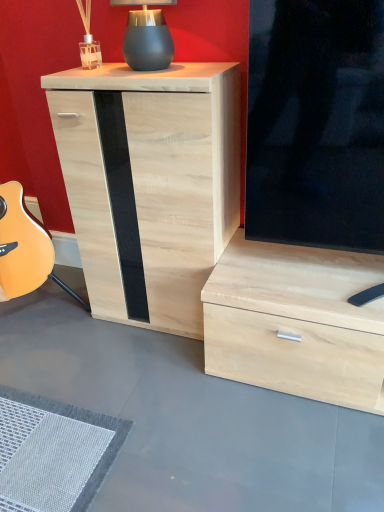
At what (x,y) coordinates should I click in order to perform the action: click on matte black lamp at upper center. Please return your answer as a coordinate pair (x, y). This screenshot has height=512, width=384. Looking at the image, I should click on (147, 36).

The image size is (384, 512). What do you see at coordinates (147, 36) in the screenshot?
I see `matte black lamp at upper center` at bounding box center [147, 36].

The image size is (384, 512). What do you see at coordinates (149, 183) in the screenshot? I see `natural wood cabinet at center` at bounding box center [149, 183].

This screenshot has width=384, height=512. I want to click on natural wood cabinet at center, so click(149, 183).

Find the location of a particular element. This screenshot has width=384, height=512. matte black lamp at upper center is located at coordinates (147, 36).

Considering the positions of objects natural wood cabinet at center and matte black lamp at upper center in the image provided, who is more to the left, natural wood cabinet at center or matte black lamp at upper center?

Positioned to the left is matte black lamp at upper center.

Which object is further away from the camera, natural wood cabinet at center or matte black lamp at upper center?

Positioned behind is matte black lamp at upper center.

Is point (206, 254) farther from viewer compared to point (149, 16)?

That is True.

From the image's perspective, between natural wood cabinet at center and matte black lamp at upper center, who is located below?

natural wood cabinet at center.

From a real-world perspective, is natural wood cabinet at center located beneath matte black lamp at upper center?

Yes, from a real-world perspective, natural wood cabinet at center is beneath matte black lamp at upper center.

Which object is thinner, natural wood cabinet at center or matte black lamp at upper center?

With smaller width is matte black lamp at upper center.

Between natural wood cabinet at center and matte black lamp at upper center, which one has more height?

natural wood cabinet at center.

Is natural wood cabinet at center bigger than matte black lamp at upper center?

Indeed, natural wood cabinet at center has a larger size compared to matte black lamp at upper center.

Consider the image. Is natural wood cabinet at center spatially inside matte black lamp at upper center, or outside of it?

natural wood cabinet at center is located beyond the bounds of matte black lamp at upper center.

Is natural wood cabinet at center not near matte black lamp at upper center?

No, there isn't a large distance between natural wood cabinet at center and matte black lamp at upper center.

Is natural wood cabinet at center oriented towards matte black lamp at upper center?

No, natural wood cabinet at center does not turn towards matte black lamp at upper center.

Can you tell me how much natural wood cabinet at center and matte black lamp at upper center differ in facing direction?

The facing directions of natural wood cabinet at center and matte black lamp at upper center are 2.68 degrees apart.

How distant is natural wood cabinet at center from matte black lamp at upper center?

natural wood cabinet at center and matte black lamp at upper center are 14.80 inches apart.

The image size is (384, 512). What are the coordinates of `table lamp behind the natural wood cabinet at center` in the screenshot? It's located at (147, 36).

Which is more to the right, matte black lamp at upper center or natural wood cabinet at center?

natural wood cabinet at center.

Is matte black lamp at upper center in front of or behind natural wood cabinet at center in the image?

Clearly, matte black lamp at upper center is behind natural wood cabinet at center.

Which is nearer, (144,22) or (205,103)?

Point (144,22) appears to be farther away from the viewer than point (205,103).

From the image's perspective, is matte black lamp at upper center on top of natural wood cabinet at center?

Correct, matte black lamp at upper center appears higher than natural wood cabinet at center in the image.

From a real-world perspective, is matte black lamp at upper center positioned under natural wood cabinet at center based on gravity?

No, from a real-world perspective, matte black lamp at upper center is not below natural wood cabinet at center.

Is matte black lamp at upper center thinner than natural wood cabinet at center?

Indeed, matte black lamp at upper center has a lesser width compared to natural wood cabinet at center.

Looking at this image, does matte black lamp at upper center have a greater height compared to natural wood cabinet at center?

Incorrect, the height of matte black lamp at upper center is not larger of that of natural wood cabinet at center.

Can you confirm if matte black lamp at upper center is bigger than natural wood cabinet at center?

Incorrect, matte black lamp at upper center is not larger than natural wood cabinet at center.

Is matte black lamp at upper center not inside natural wood cabinet at center?

matte black lamp at upper center is positioned outside natural wood cabinet at center.

In the scene shown: Can you see matte black lamp at upper center touching natural wood cabinet at center?

They are not placed beside each other.

Is matte black lamp at upper center turned away from natural wood cabinet at center?

matte black lamp at upper center does not have its back to natural wood cabinet at center.

How far apart are matte black lamp at upper center and natural wood cabinet at center?

matte black lamp at upper center is 14.80 inches away from natural wood cabinet at center.

Identify the location of table lamp on the left of natural wood cabinet at center. (147, 36).

In the image, there is a matte black lamp at upper center. Identify the location of the chest of drawers below it (from the image's perspective). Image resolution: width=384 pixels, height=512 pixels. (149, 183).

You are a GUI agent. You are given a task and a screenshot of the screen. Output one action in this format:
    pyautogui.click(x=<x>, y=<y>)
    Task: Click on the chest of drawers in front of the matte black lamp at upper center
    The width and height of the screenshot is (384, 512).
    Given the screenshot: What is the action you would take?
    pyautogui.click(x=149, y=183)